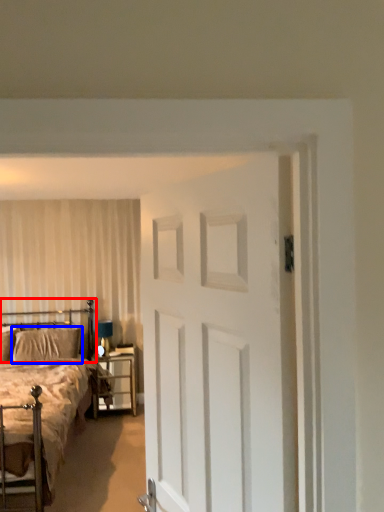
Question: Which object appears closest to the camera in this image, headboard (highlighted by a red box) or pillow (highlighted by a blue box)?

Choices:
 (A) headboard
 (B) pillow

Answer: (A)